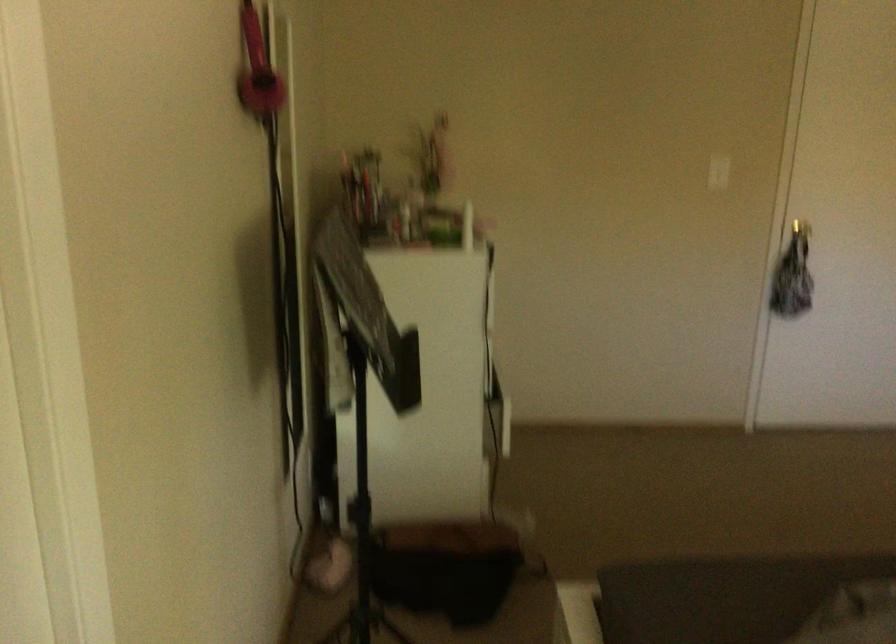
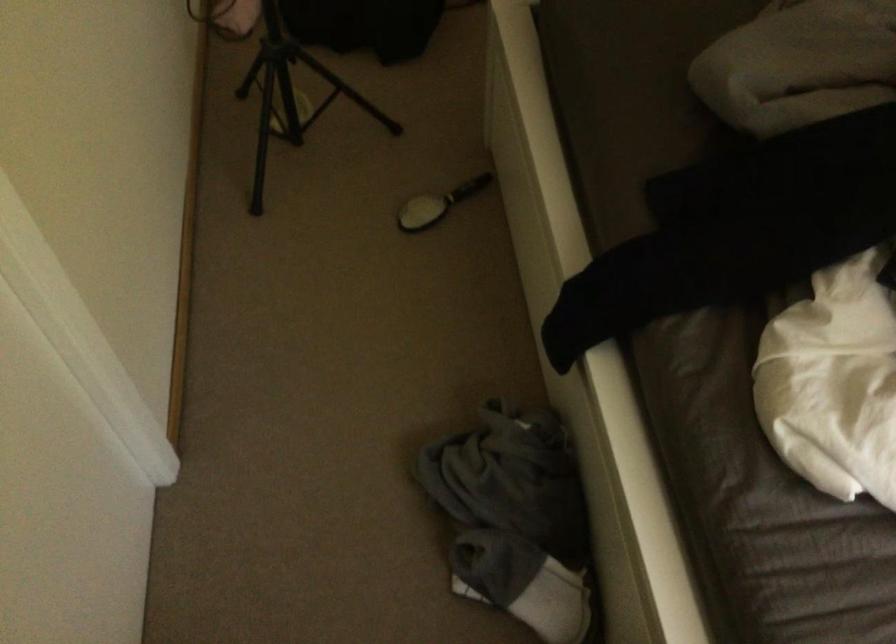
Question: The first image is from the beginning of the video and the second image is from the end. How did the camera likely rotate when shooting the video?

Choices:
 (A) Left
 (B) Right
 (C) Up
 (D) Down

Answer: (D)